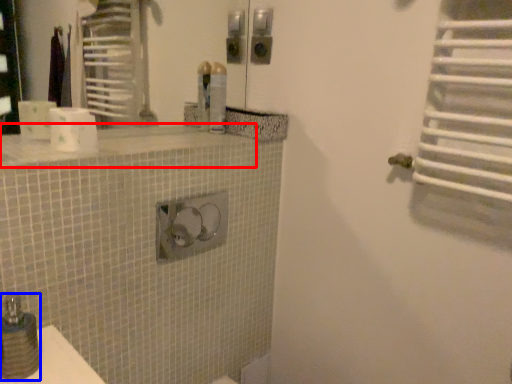
Question: Which point is closer to the camera, counter top (highlighted by a red box) or soap dispenser (highlighted by a blue box)?

Choices:
 (A) counter top
 (B) soap dispenser

Answer: (B)